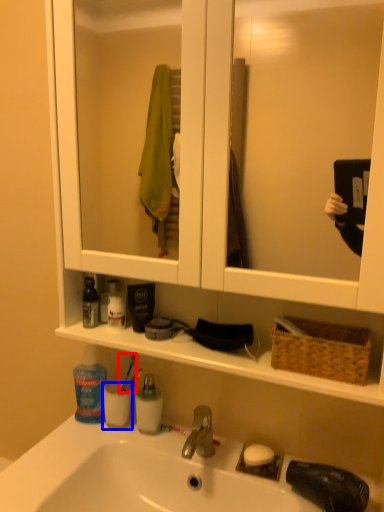
Question: Which of the following is the closest to the observer, toothbrush (highlighted by a red box) or mouthwash (highlighted by a blue box)?

Choices:
 (A) toothbrush
 (B) mouthwash

Answer: (B)